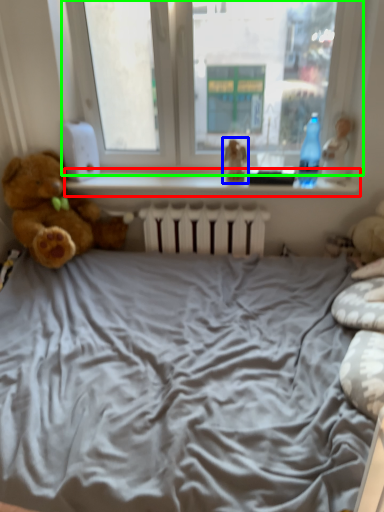
Question: Considering the real-world distances, which object is farthest from window sill (highlighted by a red box)? toy (highlighted by a blue box) or window (highlighted by a green box)?

Choices:
 (A) toy
 (B) window

Answer: (B)